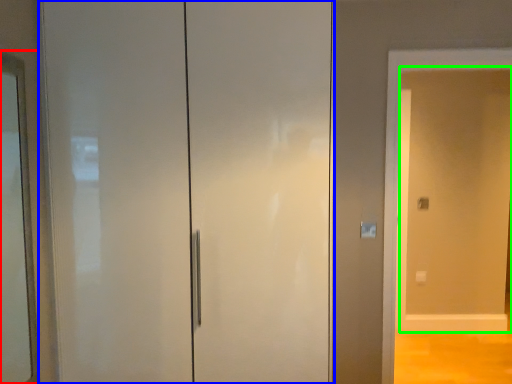
Question: Which object is the farthest from mirror (highlighted by a red box)? Choose among these: door (highlighted by a blue box) or screen door (highlighted by a green box).

Choices:
 (A) door
 (B) screen door

Answer: (B)